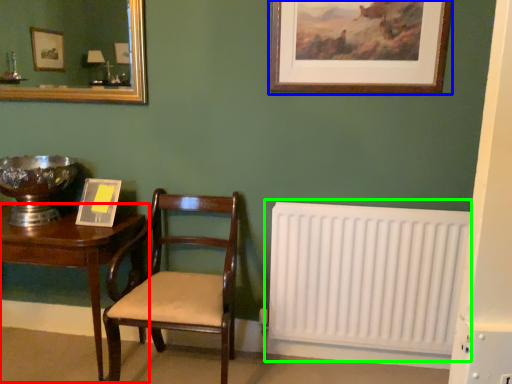
Question: Which object is positioned farthest from table (highlighted by a red box)? Select from picture frame (highlighted by a blue box) and radiator (highlighted by a green box).

Choices:
 (A) picture frame
 (B) radiator

Answer: (A)